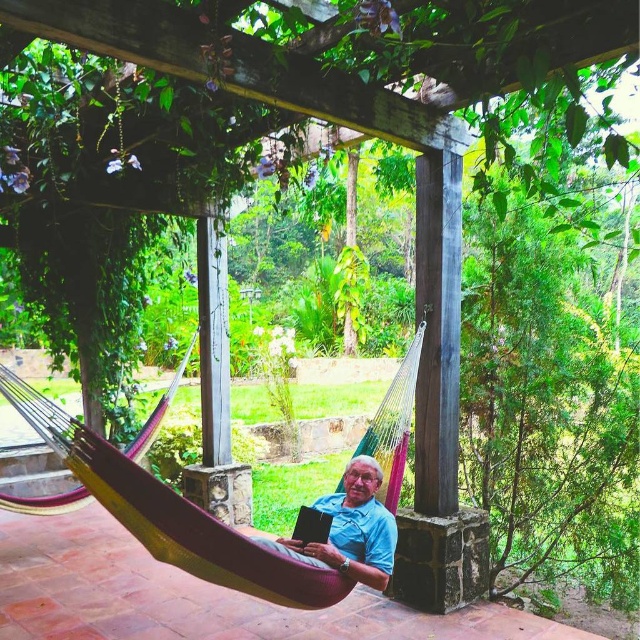
Question: Can you confirm if multicolored fabric hammock at center is positioned to the right of blue cotton shirt at center?

Choices:
 (A) no
 (B) yes

Answer: (A)

Question: Which point is farther to the camera?

Choices:
 (A) multicolored fabric hammock at center
 (B) blue cotton shirt at center

Answer: (B)

Question: Which object appears closest to the camera in this image?

Choices:
 (A) blue cotton shirt at center
 (B) multicolored fabric hammock at center

Answer: (B)

Question: Is multicolored fabric hammock at center bigger than blue cotton shirt at center?

Choices:
 (A) yes
 (B) no

Answer: (A)

Question: Which point is farther to the camera?

Choices:
 (A) (60, 429)
 (B) (380, 513)

Answer: (B)

Question: Is multicolored fabric hammock at center behind blue cotton shirt at center?

Choices:
 (A) no
 (B) yes

Answer: (A)